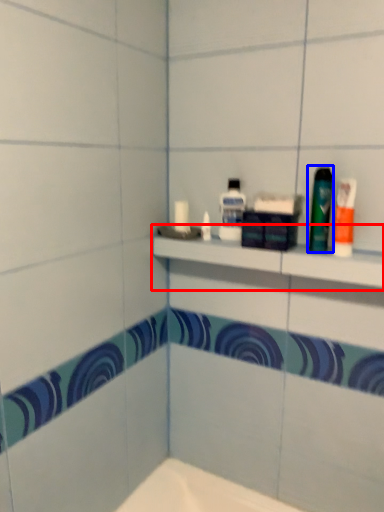
Question: Among these objects, which one is nearest to the camera, shelf (highlighted by a red box) or mouthwash (highlighted by a blue box)?

Choices:
 (A) shelf
 (B) mouthwash

Answer: (A)